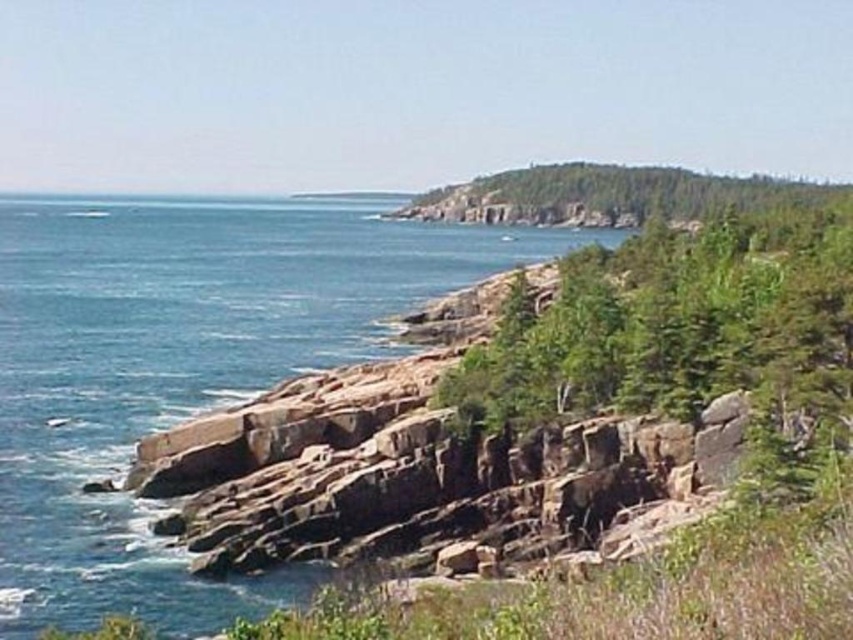
You are standing on the cliff looking out at the blue water at center and the green leafy hillside at upper center. Which of these two objects appears taller from your viewpoint?

The green leafy hillside at upper center appears taller than the blue water at center because the blue water at center is not as tall as the green leafy hillside at upper center according to the description.

You are standing on the cliff looking out at the blue water at center and the green leafy hillside at upper center. Which object is closer to you?

The blue water at center is closer to you because it is in front of the green leafy hillside at upper center.